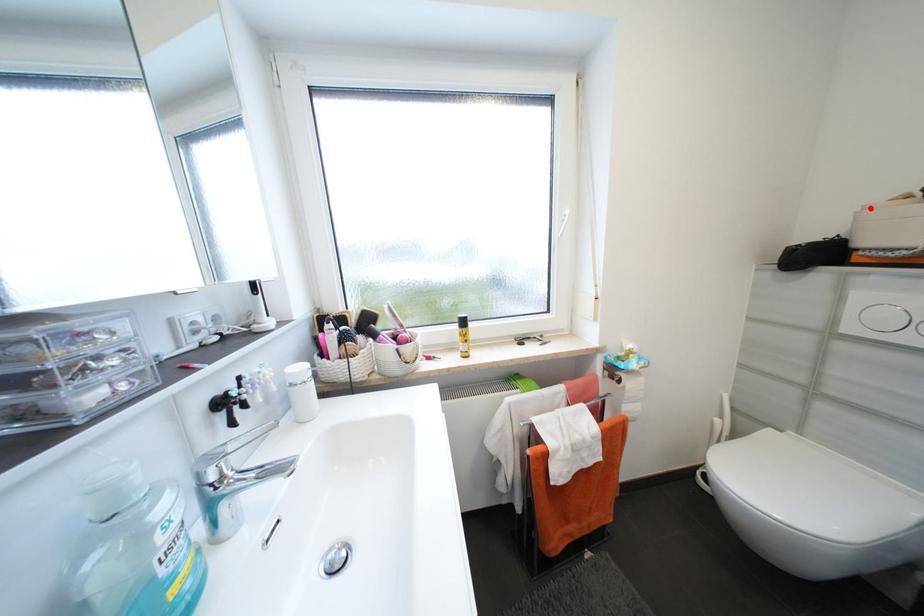
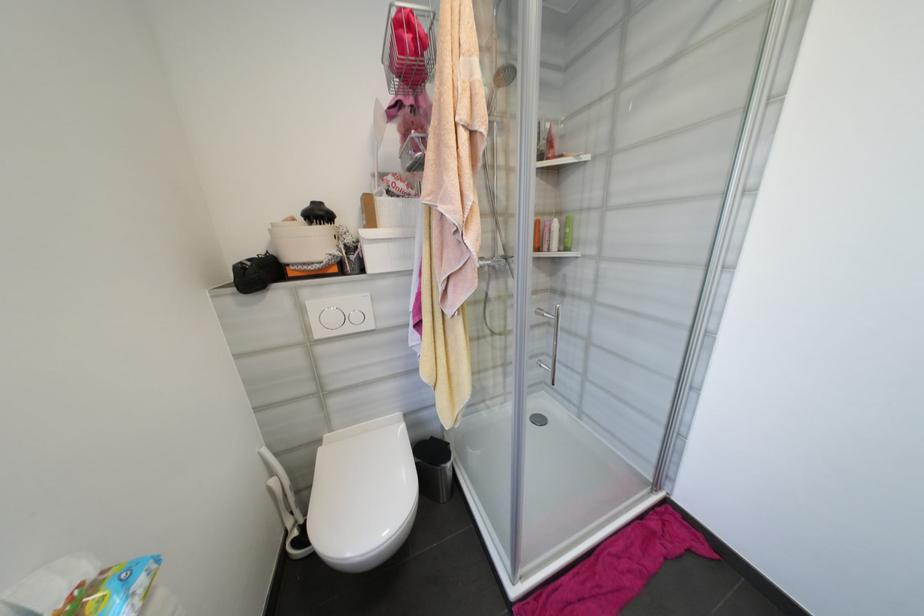
In the second image, find the point that corresponds to the highlighted location in the first image.

(280, 225)